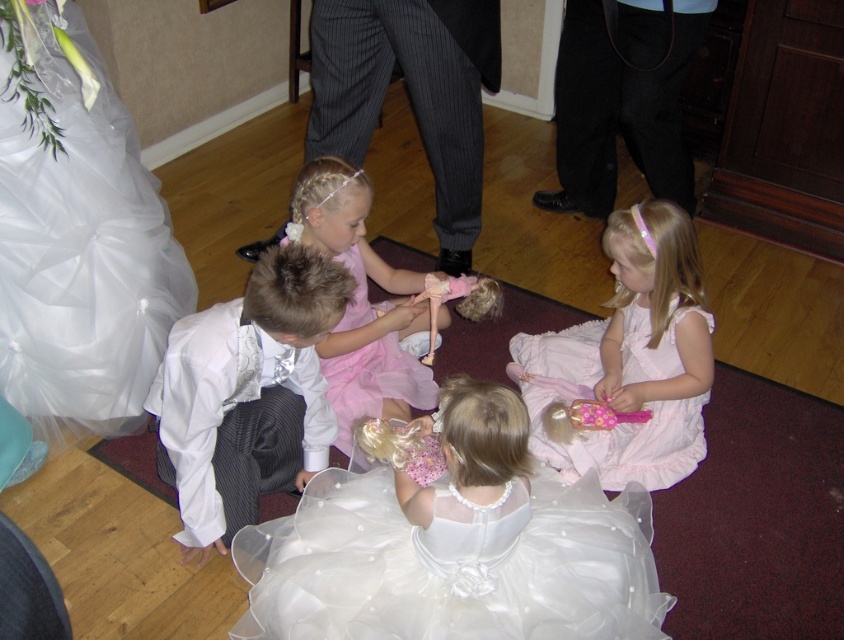
You are a photographer setting up for a group photo. You need to position the white satin dress at center and the pink tulle dress at center so that both are visible in the frame. Given their sizes, which dress should be placed closer to the camera to ensure both are fully visible?

The white satin dress at center is larger in size than the pink tulle dress at center. To ensure both are fully visible, the smaller pink tulle dress at center should be placed closer to the camera while the larger white satin dress at center can be positioned slightly further back.

You are a photographer standing at the entrance of the room. You need to take a photo of the pink tulle dress at lower center and the child holding a doll with blonde hair and a pink outfit. How far apart are these two subjects?

The pink tulle dress at lower center and the child holding a doll with blonde hair and a pink outfit are 7.38 feet apart.